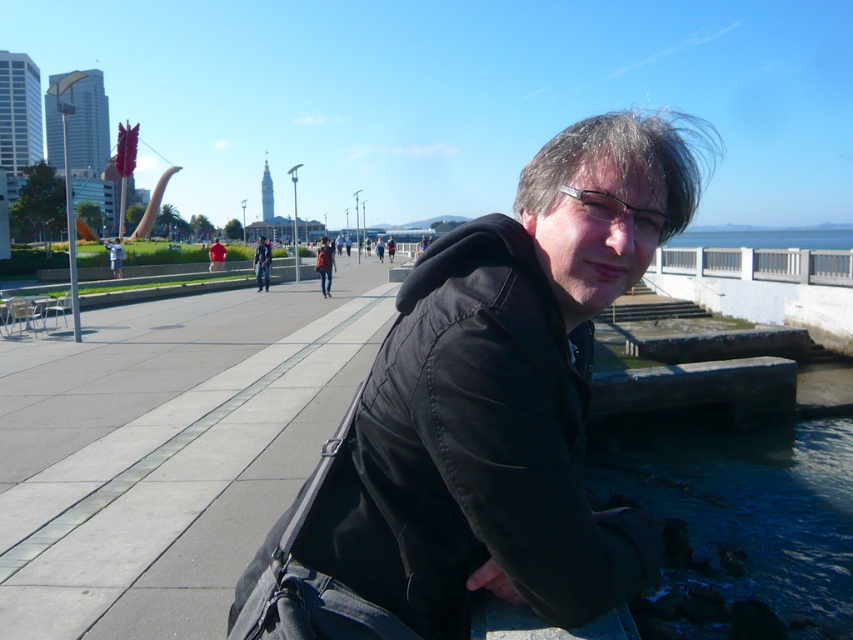
Question: Which of the following is the farthest from the observer?

Choices:
 (A) red fabric shirt at center
 (B) matte black jacket at center
 (C) blue glassy water at lower right

Answer: (A)

Question: Does black matte jacket at center appear under matte black jacket at center?

Choices:
 (A) no
 (B) yes

Answer: (B)

Question: Which of the following is the farthest from the observer?

Choices:
 (A) matte black jacket at center
 (B) black matte jacket at center
 (C) denim jeans at center

Answer: (A)

Question: Which object is farther from the camera taking this photo?

Choices:
 (A) matte black jacket at center
 (B) black matte jacket at center
 (C) red fabric shirt at center

Answer: (C)

Question: Can you confirm if matte black jacket at center is positioned to the right of red fabric shirt at center?

Choices:
 (A) no
 (B) yes

Answer: (A)

Question: Is black matte jacket at center to the right of matte black jacket at center from the viewer's perspective?

Choices:
 (A) yes
 (B) no

Answer: (A)